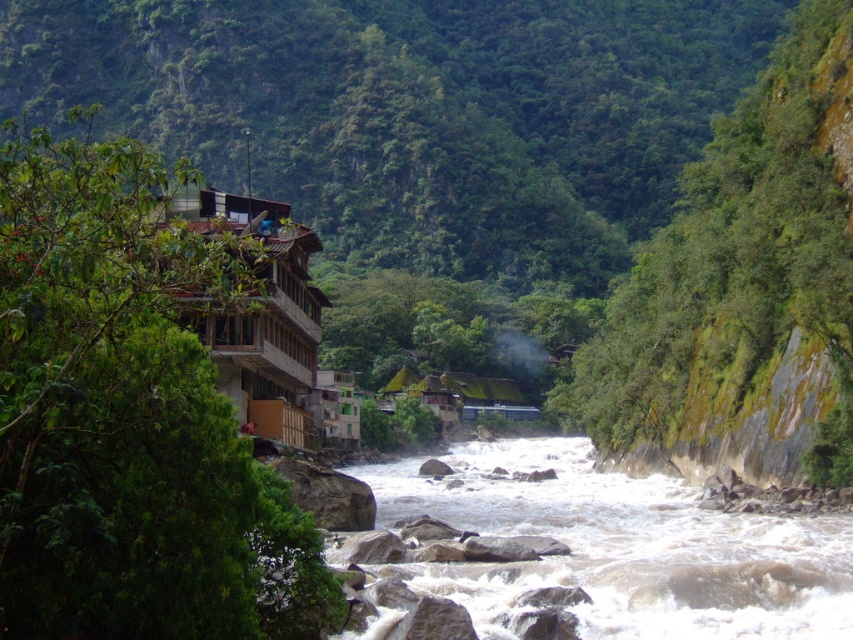
In the scene shown: Is white frothy water at center behind wooden balcony at left?

Yes, white frothy water at center is behind wooden balcony at left.

Which is more to the left, white frothy water at center or wooden balcony at left?

wooden balcony at left is more to the left.

The image size is (853, 640). Describe the element at coordinates (624, 547) in the screenshot. I see `white frothy water at center` at that location.

I want to click on white frothy water at center, so click(624, 547).